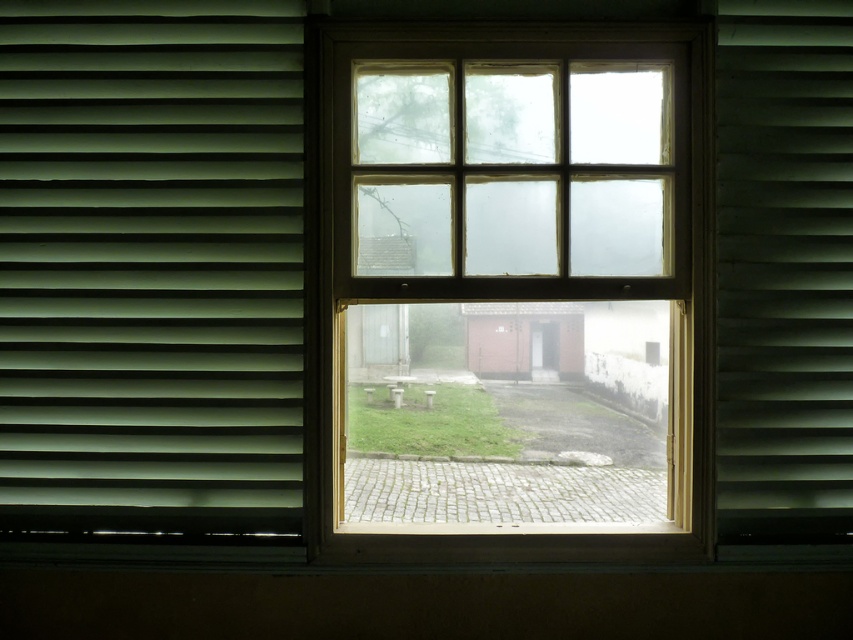
You are standing at a distance of 2.5 meters from the window. You notice a point marked at coordinates point (73, 22) on the window. Can you reach this point without moving closer than your current position?

The distance of point (73, 22) from viewer is 2.90 meters. Since you are currently 2.5 meters away, you are closer than the point, so you cannot reach it without moving further back.

You are an interior designer assessing the view from the clear glass window at center and the green matte shutter at right. Which object allows a clearer view of the outdoor cobblestone path leading to the red brick shed?

The clear glass window at center allows a clearer view of the outdoor cobblestone path leading to the red brick shed because it is made of clear glass, unlike the green matte shutter at right which likely obstructs the view more due to its matte finish.

You are standing outside the building and want to look through the clear glass window at center. Can you see the green matte blinds at left through the window?

The clear glass window at center is in front of the green matte blinds at left, so when you look through the window, you will see the blinds directly in front of you, blocking the view beyond.